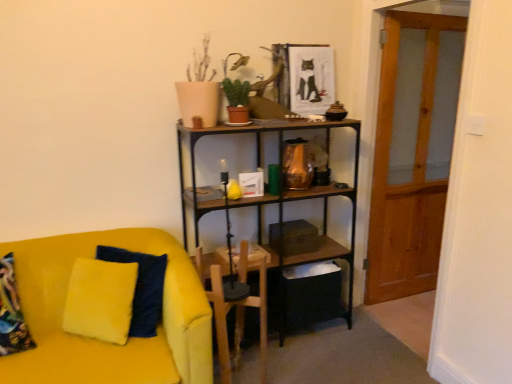
This screenshot has width=512, height=384. Describe the element at coordinates (409, 155) in the screenshot. I see `transparent wooden door at right` at that location.

This screenshot has height=384, width=512. Describe the element at coordinates (236, 92) in the screenshot. I see `green matte plant at upper center` at that location.

Find the location of a particular element. Image resolution: width=512 pixels, height=384 pixels. wooden armchair at center is located at coordinates (239, 311).

Identify the location of velvet yellow couch at left. 101,341.

The height and width of the screenshot is (384, 512). Identify the location of transparent wooden door at right. (409, 155).

Does wooden armchair at center turn towards green matte plant at upper center?

No.

Who is bigger, wooden armchair at center or green matte plant at upper center?

wooden armchair at center is bigger.

Locate an element on the screen. plant that is on the right side of wooden armchair at center is located at coordinates (236, 92).

What's the angular difference between wooden armchair at center and green matte plant at upper center's facing directions?

The angular difference between wooden armchair at center and green matte plant at upper center is 11.1 degrees.

Is wooden armchair at center turned away from velvet yellow couch at left?

No, wooden armchair at center is not facing the opposite direction of velvet yellow couch at left.

From the image's perspective, is wooden armchair at center located beneath velvet yellow couch at left?

Incorrect, from the image's perspective, wooden armchair at center is higher than velvet yellow couch at left.

From the picture: Would you say wooden armchair at center is a long distance from velvet yellow couch at left?

They are positioned close to each other.

How much distance is there between wooden armchair at center and velvet yellow couch at left?

A distance of 20.24 inches exists between wooden armchair at center and velvet yellow couch at left.

Does transparent wooden door at right touch green matte plant at upper center?

No, transparent wooden door at right is not making contact with green matte plant at upper center.

Is green matte plant at upper center a part of transparent wooden door at right?

No, green matte plant at upper center is located outside of transparent wooden door at right.

Which of these two, transparent wooden door at right or green matte plant at upper center, stands taller?

transparent wooden door at right.

Is point (398, 249) closer or farther from the camera than point (230, 101)?

Point (398, 249) appears to be farther away from the viewer than point (230, 101).

Considering the sizes of objects velvet yellow couch at left and green matte plant at upper center in the image provided, who is wider, velvet yellow couch at left or green matte plant at upper center?

Wider between the two is velvet yellow couch at left.

Do you think velvet yellow couch at left is within green matte plant at upper center, or outside of it?

velvet yellow couch at left is spatially situated outside green matte plant at upper center.

Which of these two, velvet yellow couch at left or green matte plant at upper center, is smaller?

With smaller size is green matte plant at upper center.

Is transparent wooden door at right facing towards velvet yellow couch at left?

Yes, transparent wooden door at right is facing velvet yellow couch at left.

What's the angular difference between transparent wooden door at right and velvet yellow couch at left's facing directions?

89.9 degrees.

Which is less distant, (386,262) or (115,358)?

The point (115,358) is more forward.

Who is bigger, transparent wooden door at right or velvet yellow couch at left?

velvet yellow couch at left is bigger.

Considering the sizes of objects velvet yellow couch at left and wooden armchair at center in the image provided, who is bigger, velvet yellow couch at left or wooden armchair at center?

velvet yellow couch at left is bigger.

Which object is further away from the camera taking this photo, velvet yellow couch at left or wooden armchair at center?

Positioned behind is wooden armchair at center.

From the picture: From a real-world perspective, is velvet yellow couch at left on wooden armchair at center?

Incorrect, from a real-world perspective, velvet yellow couch at left is lower than wooden armchair at center.

From the image's perspective, relative to transparent wooden door at right, is green matte plant at upper center above or below?

green matte plant at upper center is above transparent wooden door at right.

Does green matte plant at upper center have a lesser width compared to transparent wooden door at right?

Indeed, green matte plant at upper center has a lesser width compared to transparent wooden door at right.

Is green matte plant at upper center turned away from transparent wooden door at right?

No, green matte plant at upper center is not facing away from transparent wooden door at right.

From their relative heights in the image, would you say green matte plant at upper center is taller or shorter than transparent wooden door at right?

Considering their sizes, green matte plant at upper center has less height than transparent wooden door at right.

This screenshot has height=384, width=512. I want to click on armchair that is under the green matte plant at upper center (from a real-world perspective), so click(x=239, y=311).

Where is `armchair behind the velvet yellow couch at left`? This screenshot has height=384, width=512. armchair behind the velvet yellow couch at left is located at coordinates (239, 311).

Looking at this image, based on their spatial positions, is wooden armchair at center or transparent wooden door at right further from green matte plant at upper center?

transparent wooden door at right is further to green matte plant at upper center.

Estimate the real-world distances between objects in this image. Which object is further from velvet yellow couch at left, green matte plant at upper center or transparent wooden door at right?

Among the two, transparent wooden door at right is located further to velvet yellow couch at left.

Which object lies nearer to the anchor point transparent wooden door at right, wooden armchair at center or green matte plant at upper center?

Among the two, wooden armchair at center is located nearer to transparent wooden door at right.

From the picture: Looking at the image, which one is located further to transparent wooden door at right, velvet yellow couch at left or wooden armchair at center?

velvet yellow couch at left.

Which object lies nearer to the anchor point green matte plant at upper center, velvet yellow couch at left or wooden armchair at center?

wooden armchair at center.

When comparing their distances from velvet yellow couch at left, does green matte plant at upper center or wooden armchair at center seem closer?

Among the two, wooden armchair at center is located nearer to velvet yellow couch at left.

From the image, which object appears to be farther from velvet yellow couch at left, wooden armchair at center or transparent wooden door at right?

Based on the image, transparent wooden door at right appears to be further to velvet yellow couch at left.

Based on their spatial positions, is green matte plant at upper center or transparent wooden door at right further from wooden armchair at center?

transparent wooden door at right is further to wooden armchair at center.

This screenshot has width=512, height=384. Identify the location of armchair between green matte plant at upper center and velvet yellow couch at left in the vertical direction. (239, 311).

The image size is (512, 384). What are the coordinates of `plant between velvet yellow couch at left and transparent wooden door at right from left to right` in the screenshot? It's located at tap(236, 92).

The image size is (512, 384). I want to click on armchair between velvet yellow couch at left and transparent wooden door at right from left to right, so click(239, 311).

The height and width of the screenshot is (384, 512). Identify the location of glass door between green matte plant at upper center and wooden armchair at center in the vertical direction. (409, 155).